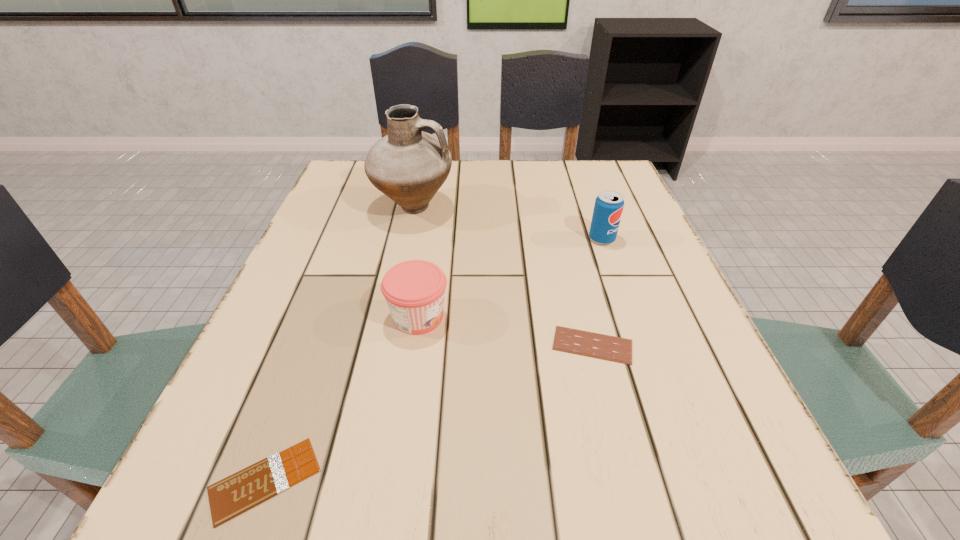
Locate an element on the screen. The width and height of the screenshot is (960, 540). the tallest object is located at coordinates (409, 166).

This screenshot has height=540, width=960. Find the location of `the second tallest object`. the second tallest object is located at coordinates pos(608,208).

Image resolution: width=960 pixels, height=540 pixels. What are the coordinates of `the third shortest object` in the screenshot? It's located at (414, 290).

Find the location of a particular element. The image size is (960, 540). the right chocolate bar is located at coordinates (590, 344).

Locate an element on the screen. This screenshot has width=960, height=540. the taller chocolate bar is located at coordinates (590, 344).

Find the location of `the shorter chocolate bar`. the shorter chocolate bar is located at coordinates (253, 485).

Locate an element on the screen. This screenshot has width=960, height=540. the nearer chocolate bar is located at coordinates (253, 485).

Image resolution: width=960 pixels, height=540 pixels. Identify the location of vacant area situated on the handle side of the pitcher. (570, 208).

At what (x,y) coordinates should I click in order to perform the action: click on vacant position located 0.340m on the front of the second tallest object. Please return your answer as a coordinate pair (x, y). Looking at the image, I should click on (651, 378).

The width and height of the screenshot is (960, 540). Identify the location of vacant space situated 0.220m on the front label of the jam. (572, 316).